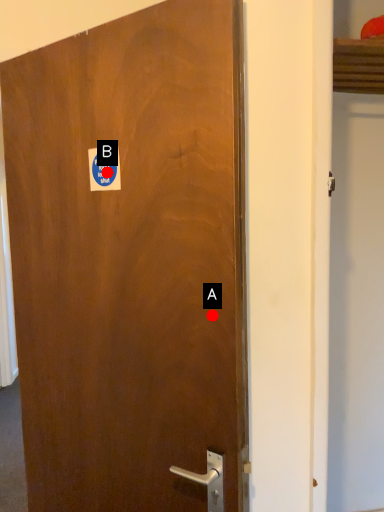
Question: Two points are circled on the image, labeled by A and B beside each circle. Which point is farther from the camera taking this photo?

Choices:
 (A) A is further
 (B) B is further

Answer: (B)